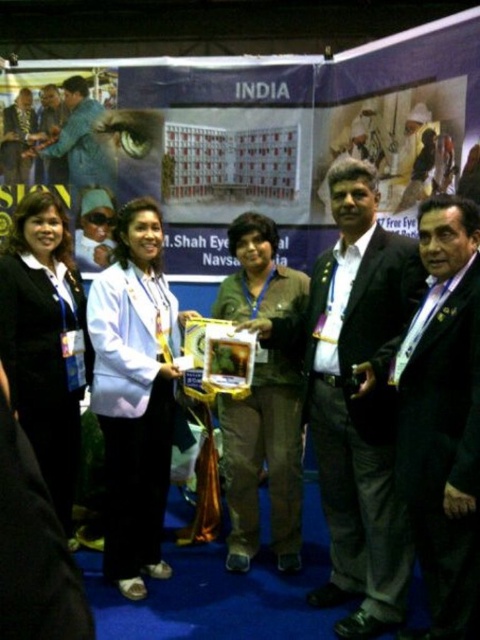
You are standing at the exhibition booth and want to place a new poster exactly at the center of the booth. The booth has a black fabric at center. Where should you place the poster?

The black fabric at center is located at point (45,340), so you should place the poster at that coordinate to center it.

From the picture: You are standing at the entrance of the exhibition hall and want to approach the person wearing the white glossy shirt at center. According to the image, where should you walk to find them?

The white glossy shirt at center is located at point 0.616 on the x axis and 0.281 on the y axis, so you should walk towards the coordinates mentioned to find them.